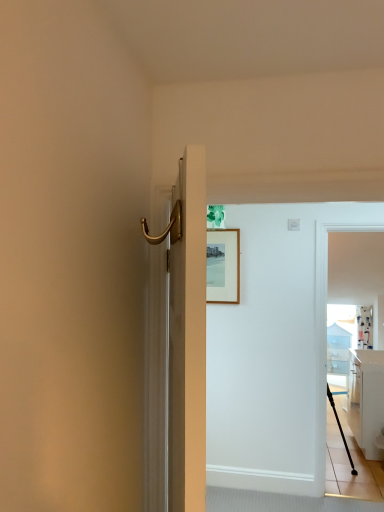
Where is `vacant space behind white glossy screen door at right`? The height and width of the screenshot is (512, 384). vacant space behind white glossy screen door at right is located at coordinates 362,482.